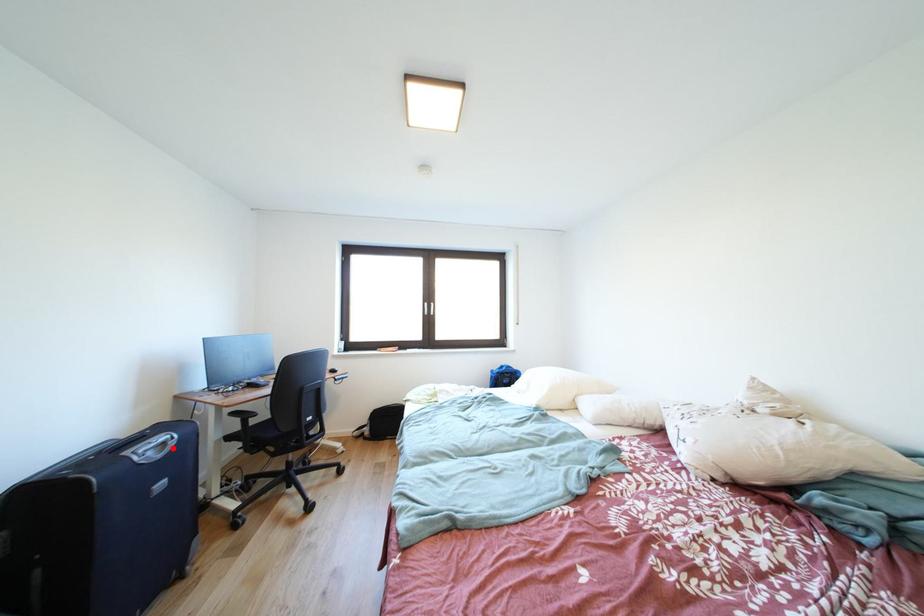
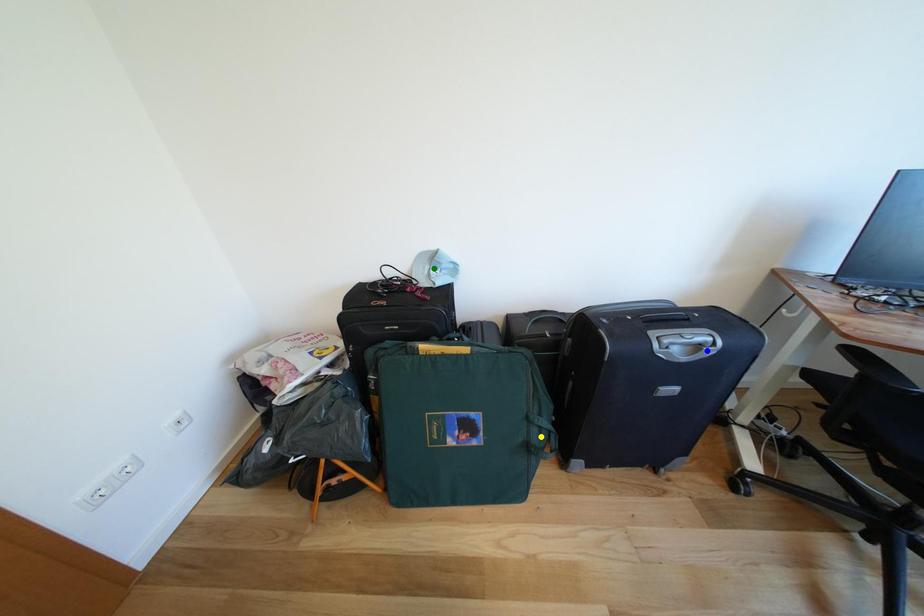
Question: I am providing you with two images of the same scene from different viewpoints. A red point is marked on the first image. You are given multiple points on the second image. In image 2, which mark is for the same physical point as the one in image 1?

Choices:
 (A) blue point
 (B) green point
 (C) yellow point

Answer: (A)